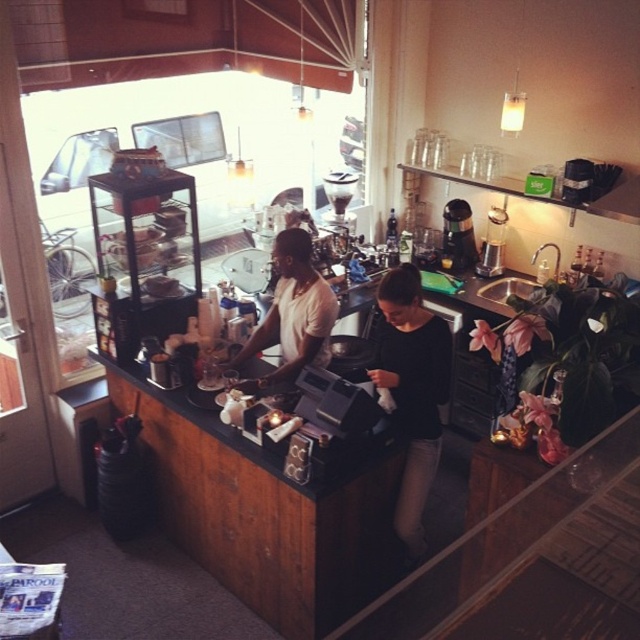
Is white matte shirt at center thinner than metallic silver coffee machine at center?

No, white matte shirt at center is not thinner than metallic silver coffee machine at center.

Between point (256, 390) and point (454, 252), which one is positioned behind?

Point (454, 252)

Where is `white matte shirt at center`? This screenshot has height=640, width=640. white matte shirt at center is located at coordinates (292, 314).

Which of these two, black matte shirt at center or white matte shirt at center, stands taller?

black matte shirt at center

Does point (384, 314) come in front of point (285, 332)?

Yes, point (384, 314) is closer to viewer.

Where is `black matte shirt at center`? The height and width of the screenshot is (640, 640). black matte shirt at center is located at coordinates (412, 388).

Who is taller, black matte shirt at center or metallic silver coffee machine at center?

With more height is black matte shirt at center.

Who is more forward, [426,419] or [465,241]?

Positioned in front is point [426,419].

At what (x,y) coordinates should I click in order to perform the action: click on black matte shirt at center. Please return your answer as a coordinate pair (x, y). This screenshot has width=640, height=640. Looking at the image, I should click on (412, 388).

Locate an element on the screen. black matte shirt at center is located at coordinates (412, 388).